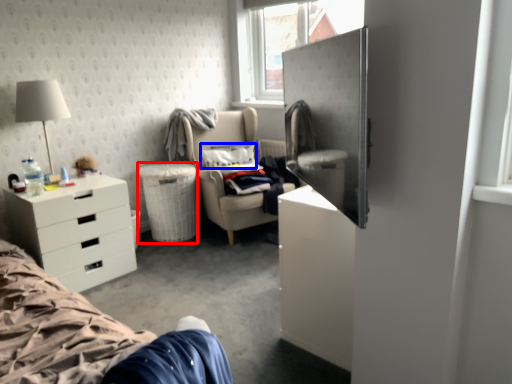
Question: Which of the following is the closest to the observer, trash bin/can (highlighted by a red box) or pillow (highlighted by a blue box)?

Choices:
 (A) trash bin/can
 (B) pillow

Answer: (A)